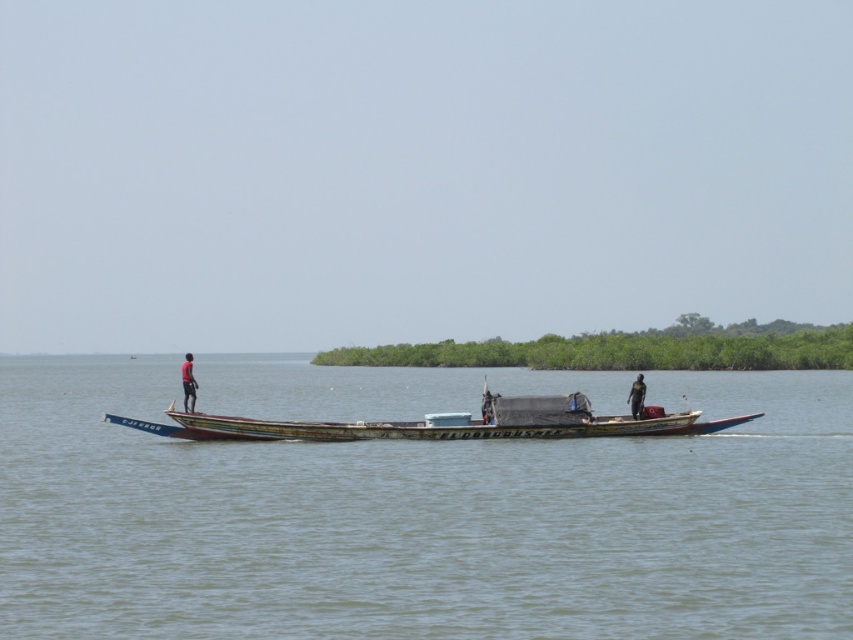
Question: Considering the relative positions of greenish water at center and dark skin human at center in the image provided, where is greenish water at center located with respect to dark skin human at center?

Choices:
 (A) left
 (B) right

Answer: (A)

Question: Does greenish water at center appear on the right side of dark skin human at center?

Choices:
 (A) no
 (B) yes

Answer: (A)

Question: Does greenish water at center appear on the right side of dark skin human at center?

Choices:
 (A) no
 (B) yes

Answer: (A)